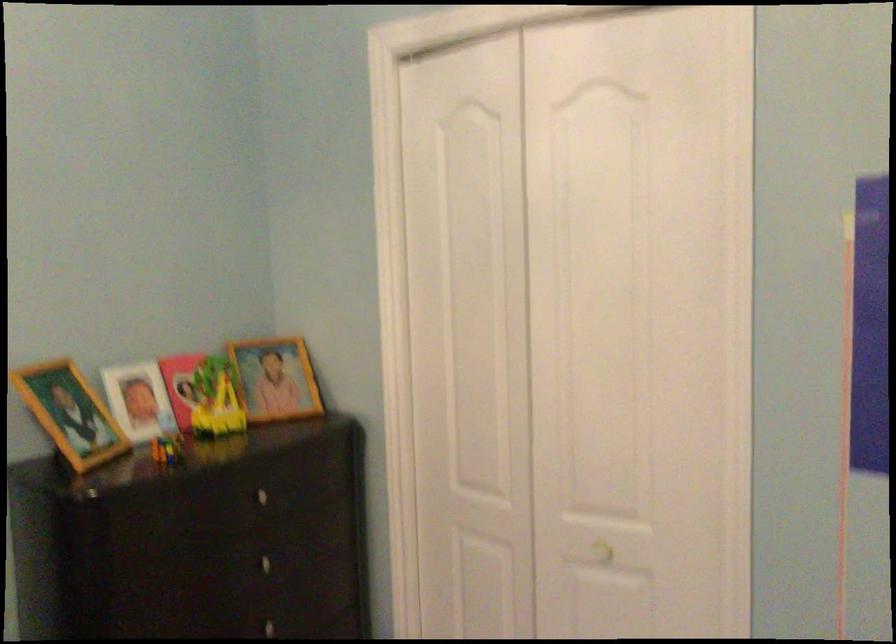
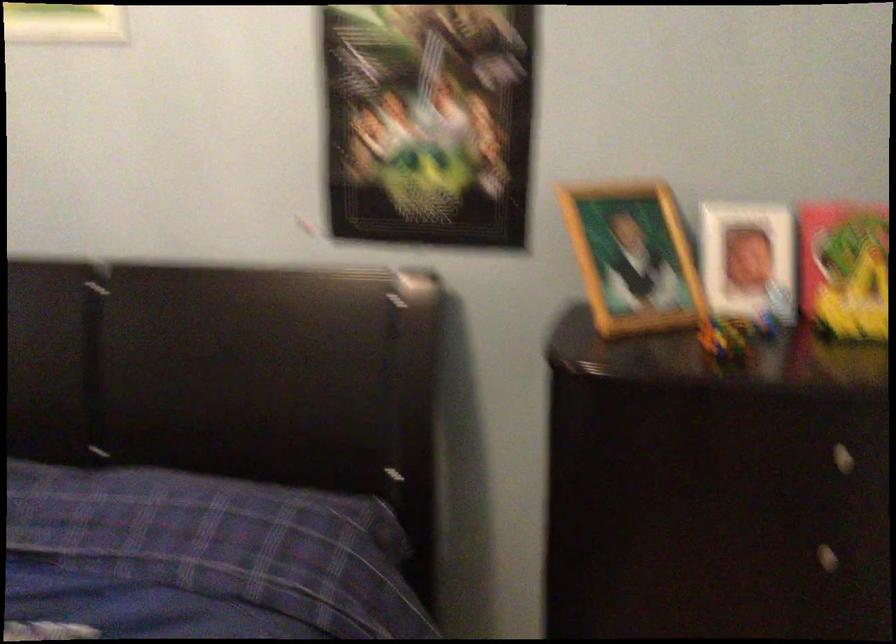
The point at (x=257, y=571) is marked in the first image. Where is the corresponding point in the second image?

(807, 554)